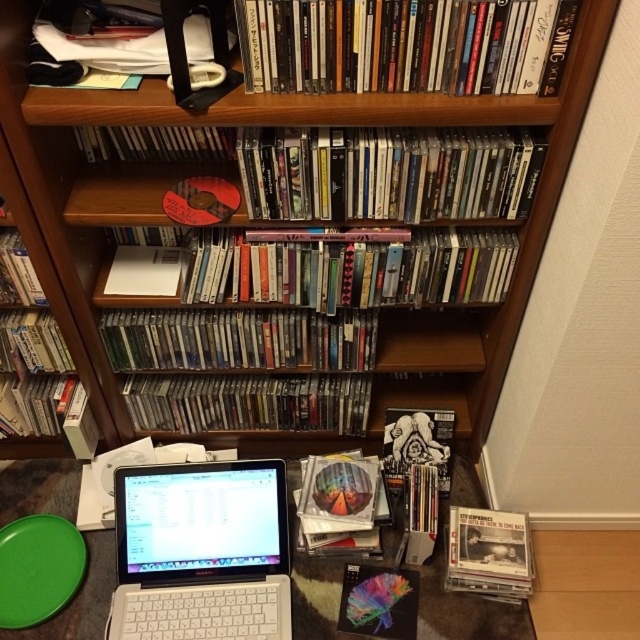
You are organizing your home office and want to place a new lamp between the white plastic table at lower center and the matte black bookshelf at upper center. Based on their positions, which side of the bookshelf should you place the lamp to ensure it is aligned with the table?

The white plastic table at lower center is to the right of the matte black bookshelf at upper center, so placing the lamp to the right side of the bookshelf would align it with the table.

You are a delivery person who needs to place a package on the desk. The package is 40 inches long. Can you fit it on the desk without moving anything else? Please explain your reasoning based on the distance between the matte plastic books at upper center and the white plastic table at lower center.

The distance between the matte plastic books at upper center and the white plastic table at lower center is 37.80 inches. Since the package is 40 inches long, which is longer than the available space, it won